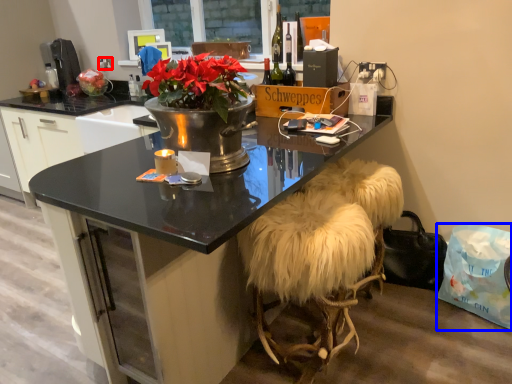
Question: Among these objects, which one is farthest to the camera, power outlet (highlighted by a red box) or handbag (highlighted by a blue box)?

Choices:
 (A) power outlet
 (B) handbag

Answer: (A)